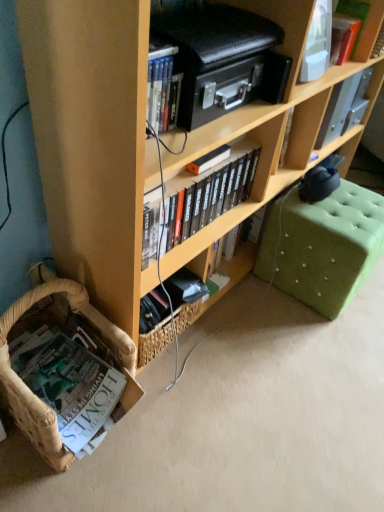
Question: From a real-world perspective, is wooden bookcase at lower left positioned under black matte bookshelf at center, positioned as the 2th book in bottom-to-top order, based on gravity?

Choices:
 (A) yes
 (B) no

Answer: (B)

Question: Would you consider wooden bookcase at lower left to be distant from black matte bookshelf at center, positioned as the 2th book in bottom-to-top order?

Choices:
 (A) yes
 (B) no

Answer: (B)

Question: Does wooden bookcase at lower left appear on the right side of black matte bookshelf at center, positioned as the 2th book in bottom-to-top order?

Choices:
 (A) no
 (B) yes

Answer: (B)

Question: Is wooden bookcase at lower left at the left side of black matte bookshelf at center, the second book viewed from the left?

Choices:
 (A) yes
 (B) no

Answer: (B)

Question: From the image's perspective, is wooden bookcase at lower left under black matte bookshelf at center, positioned as the 2th book in bottom-to-top order?

Choices:
 (A) yes
 (B) no

Answer: (B)

Question: From a real-world perspective, does wooden bookcase at lower left stand above black matte bookshelf at center, the second book viewed from the left?

Choices:
 (A) no
 (B) yes

Answer: (B)

Question: Is green tufted ottoman at lower right oriented away from hardcover book at upper right, the 3th book when ordered from bottom to top?

Choices:
 (A) no
 (B) yes

Answer: (A)

Question: From a real-world perspective, is green tufted ottoman at lower right over hardcover book at upper right, the 3th book when ordered from bottom to top?

Choices:
 (A) yes
 (B) no

Answer: (B)

Question: From the image's perspective, is green tufted ottoman at lower right located beneath hardcover book at upper right, which is the 1th book in right-to-left order?

Choices:
 (A) no
 (B) yes

Answer: (B)

Question: From a real-world perspective, is green tufted ottoman at lower right located beneath hardcover book at upper right, which is the 1th book in right-to-left order?

Choices:
 (A) no
 (B) yes

Answer: (B)

Question: Does green tufted ottoman at lower right have a greater width compared to hardcover book at upper right, the third book viewed from the left?

Choices:
 (A) yes
 (B) no

Answer: (A)

Question: Is green tufted ottoman at lower right oriented towards hardcover book at upper right, the 3th book when ordered from bottom to top?

Choices:
 (A) yes
 (B) no

Answer: (B)

Question: Considering the relative sizes of white paper book at lower left, arranged as the third book when viewed from the right, and hardcover book at upper right, the 3th book when ordered from bottom to top, in the image provided, is white paper book at lower left, arranged as the third book when viewed from the right, smaller than hardcover book at upper right, the 3th book when ordered from bottom to top,?

Choices:
 (A) yes
 (B) no

Answer: (B)